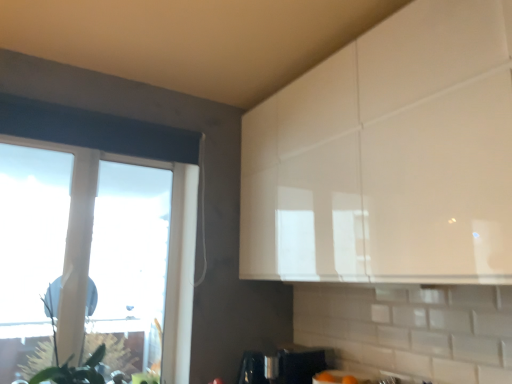
Question: Considering the relative sizes of satin silver coffee maker at lower center and transparent glass window at left in the image provided, is satin silver coffee maker at lower center thinner than transparent glass window at left?

Choices:
 (A) yes
 (B) no

Answer: (B)

Question: From a real-world perspective, is satin silver coffee maker at lower center positioned over transparent glass window at left based on gravity?

Choices:
 (A) no
 (B) yes

Answer: (A)

Question: Is satin silver coffee maker at lower center taller than transparent glass window at left?

Choices:
 (A) yes
 (B) no

Answer: (B)

Question: Considering the relative positions of satin silver coffee maker at lower center and transparent glass window at left in the image provided, is satin silver coffee maker at lower center to the left of transparent glass window at left from the viewer's perspective?

Choices:
 (A) yes
 (B) no

Answer: (B)

Question: From the image's perspective, would you say satin silver coffee maker at lower center is shown under transparent glass window at left?

Choices:
 (A) yes
 (B) no

Answer: (A)

Question: From a real-world perspective, is satin silver coffee maker at lower center above or below transparent glass window at left?

Choices:
 (A) below
 (B) above

Answer: (A)

Question: Considering the positions of satin silver coffee maker at lower center and transparent glass window at left in the image, is satin silver coffee maker at lower center bigger or smaller than transparent glass window at left?

Choices:
 (A) big
 (B) small

Answer: (B)

Question: From the image's perspective, is satin silver coffee maker at lower center located above or below transparent glass window at left?

Choices:
 (A) below
 (B) above

Answer: (A)

Question: Relative to transparent glass window at left, is satin silver coffee maker at lower center in front or behind?

Choices:
 (A) behind
 (B) front

Answer: (A)

Question: Is point (79, 135) closer or farther from the camera than point (48, 301)?

Choices:
 (A) farther
 (B) closer

Answer: (B)

Question: Is transparent glass window at left wider or thinner than green matte plant at left?

Choices:
 (A) thin
 (B) wide

Answer: (A)

Question: Is transparent glass window at left to the left or to the right of green matte plant at left in the image?

Choices:
 (A) right
 (B) left

Answer: (B)

Question: From the image's perspective, is transparent glass window at left located above or below green matte plant at left?

Choices:
 (A) below
 (B) above

Answer: (B)

Question: Looking at the image, does green matte plant at left seem bigger or smaller compared to transparent glass window at left?

Choices:
 (A) big
 (B) small

Answer: (B)

Question: Is green matte plant at left situated inside transparent glass window at left or outside?

Choices:
 (A) outside
 (B) inside

Answer: (A)